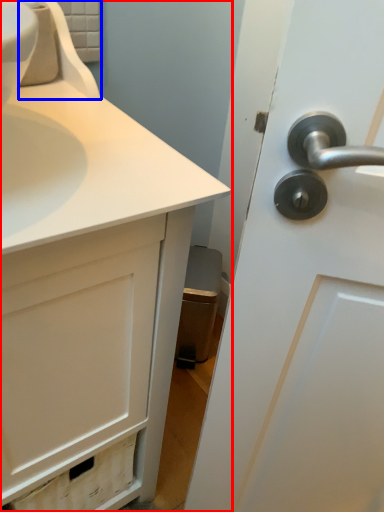
Question: Which point is closer to the camera, bathroom cabinet (highlighted by a red box) or faucet (highlighted by a blue box)?

Choices:
 (A) bathroom cabinet
 (B) faucet

Answer: (A)